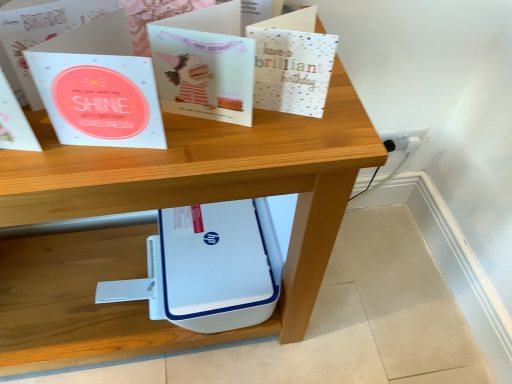
You are a GUI agent. You are given a task and a screenshot of the screen. Output one action in this format:
    pyautogui.click(x=<x>, y=<y>)
    Task: Click on the free location in front of metallic silver card at upper center, which appears as the first paperback book when viewed from the right
    
    Given the screenshot: What is the action you would take?
    pyautogui.click(x=276, y=150)